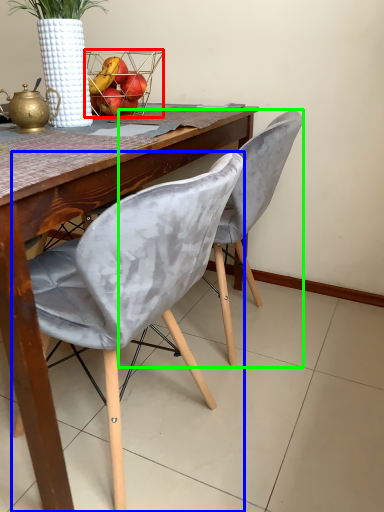
Question: Which is farther away from basket (highlighted by a red box)? chair (highlighted by a blue box) or chair (highlighted by a green box)?

Choices:
 (A) chair
 (B) chair

Answer: (A)